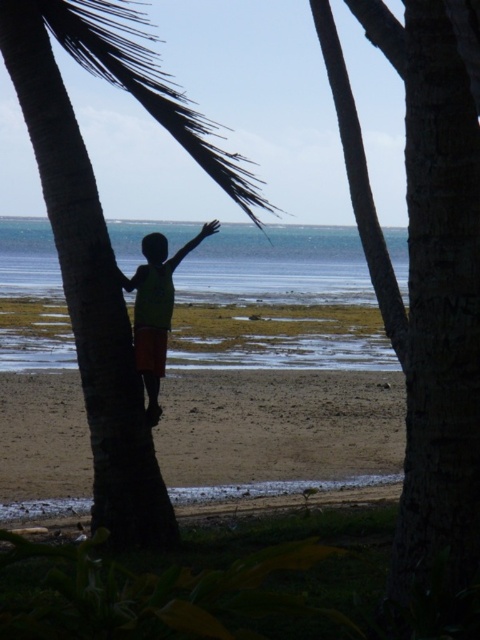
Does brown rough palm tree at left appear on the left side of green fabric shirt at center?

Indeed, brown rough palm tree at left is positioned on the left side of green fabric shirt at center.

Can you confirm if brown rough palm tree at left is taller than green fabric shirt at center?

Indeed, brown rough palm tree at left has a greater height compared to green fabric shirt at center.

Is point (90, 163) more distant than point (151, 358)?

No, (90, 163) is in front of (151, 358).

Locate an element on the screen. brown rough palm tree at left is located at coordinates (106, 234).